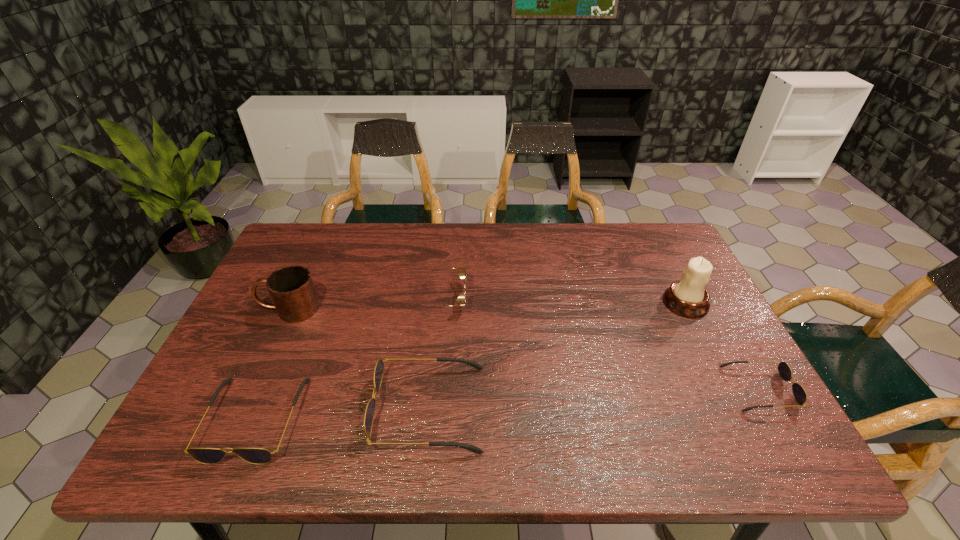
Select which sunglasses appears as the third closest to the farthest sunglasses. Please provide its 2D coordinates. Your answer should be formatted as a tuple, i.e. [(x, y)], where the tuple contains the x and y coordinates of a point satisfying the conditions above.

[(785, 372)]

Locate an element on the screen. The height and width of the screenshot is (540, 960). sunglasses that stands as the second closest to the shortest object is located at coordinates (461, 270).

Find the location of a particular element. The height and width of the screenshot is (540, 960). free spot that satisfies the following two spatial constraints: 1. on the front-facing side of the shortest object; 2. on the front-facing side of the second shortest object is located at coordinates (x=776, y=418).